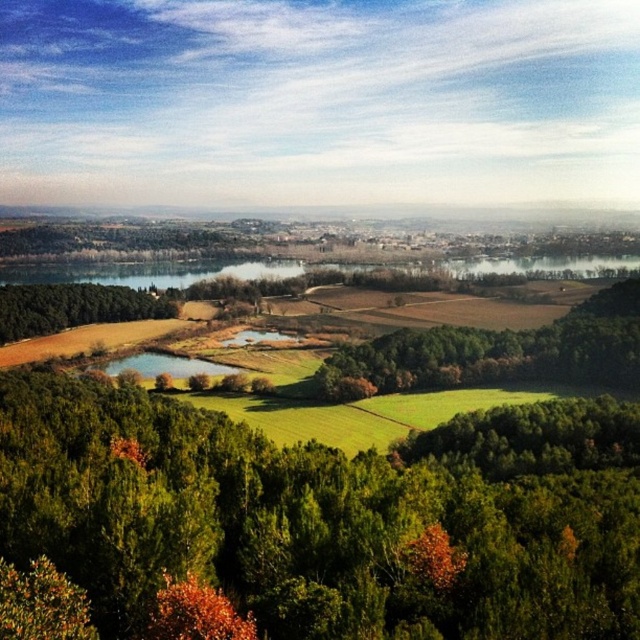
You are standing in the rural landscape scene and want to walk from the point closer to you to the point further away. Which path would you take between the two points, point (291,602) and point (90,285)?

The path from point (291,602) to point (90,285) would be the correct route since point (291,602) is closer to the viewer and you need to move towards the point (90,285) which is further away.

You are standing at the lower left corner of the image and want to walk towards the green leafy trees at center. Which direction should you move relative to the green leafy tree at lower left?

The green leafy trees at center is to the right of the green leafy tree at lower left, so you should move towards the right direction relative to the green leafy tree at lower left.